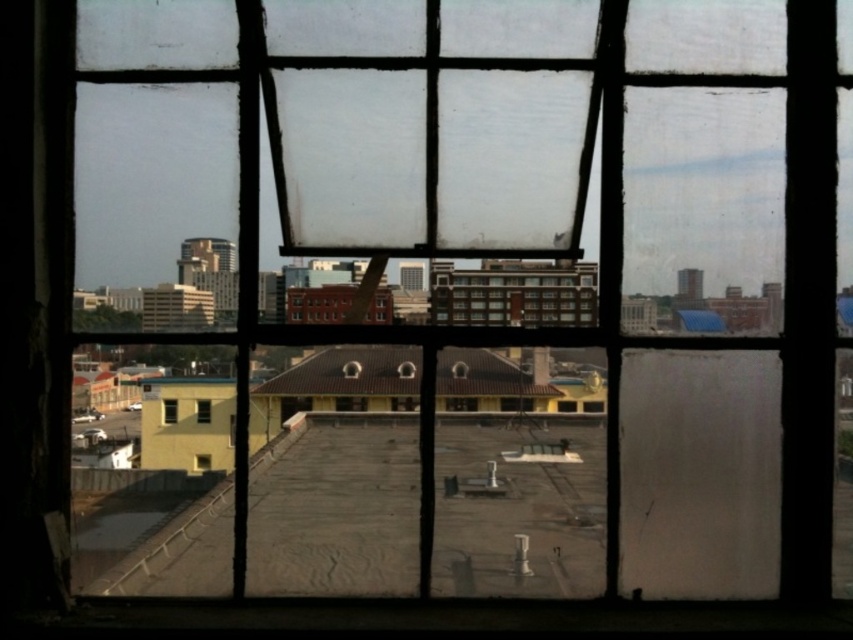
Does point (196, 404) lie in front of point (204, 465)?

That is True.

Can you confirm if transparent glass window at center is smaller than matte yellow window at lower left?

Actually, transparent glass window at center might be larger than matte yellow window at lower left.

Is point (196, 406) farther from camera compared to point (200, 458)?

No, (196, 406) is in front of (200, 458).

Identify the location of transparent glass window at center. (202, 410).

Can you confirm if clear glass window at center is wider than matte yellow window at lower left?

Incorrect, clear glass window at center's width does not surpass matte yellow window at lower left's.

Who is positioned more to the right, clear glass window at center or matte yellow window at lower left?

From the viewer's perspective, matte yellow window at lower left appears more on the right side.

Is point (165, 406) behind point (199, 456)?

That is False.

This screenshot has height=640, width=853. I want to click on clear glass window at center, so click(x=169, y=410).

Which is above, transparent glass window at center or clear glass window at center?

Positioned higher is transparent glass window at center.

Is transparent glass window at center thinner than clear glass window at center?

Incorrect, transparent glass window at center's width is not less than clear glass window at center's.

Is point (199, 404) behind point (177, 403)?

No, it is not.

The width and height of the screenshot is (853, 640). In order to click on transparent glass window at center in this screenshot , I will do click(202, 410).